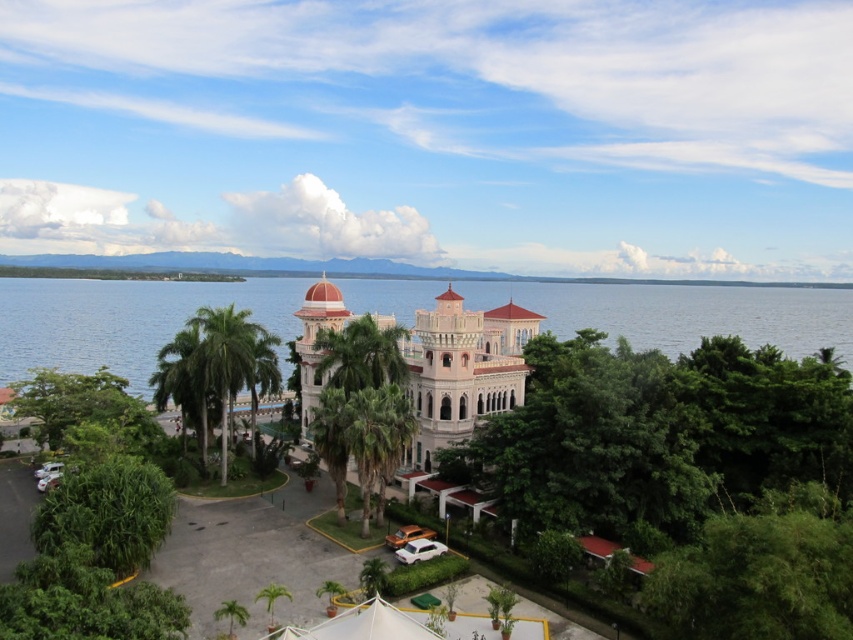
Question: Can you confirm if matte pink stone palace at center is positioned to the right of green leafy palm tree at left?

Choices:
 (A) no
 (B) yes

Answer: (B)

Question: From the image, what is the correct spatial relationship of green leafy tree at center in relation to blue water at center?

Choices:
 (A) below
 (B) above

Answer: (A)

Question: Which point is farther to the camera?

Choices:
 (A) blue water at center
 (B) matte pink stone palace at center
 (C) green leafy palm tree at left

Answer: (A)

Question: Which point is closer to the camera?

Choices:
 (A) green leafy palm tree at left
 (B) blue water at center

Answer: (A)

Question: Which object is closer to the camera taking this photo?

Choices:
 (A) green leafy tree at center
 (B) matte pink stone palace at center
 (C) green leafy palm tree at left
 (D) blue water at center

Answer: (A)

Question: Can you confirm if green leafy tree at center is smaller than blue water at center?

Choices:
 (A) yes
 (B) no

Answer: (A)